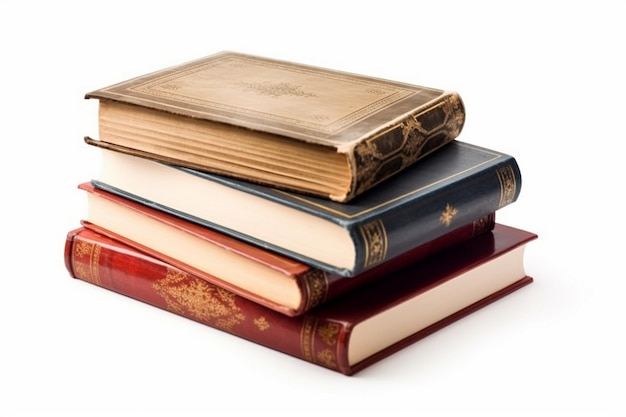
What are the coordinates of `books` in the screenshot? It's located at (265, 128), (263, 228), (220, 277), (215, 327).